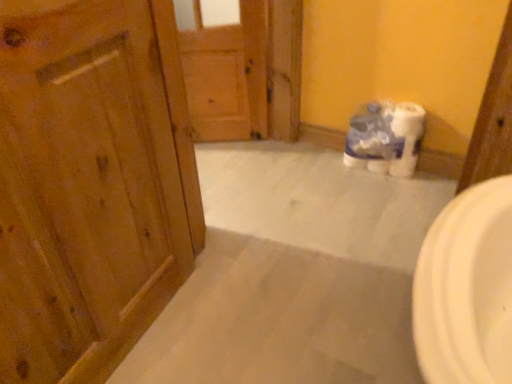
I want to click on free location in front of white plastic toilet paper at center, so click(x=385, y=192).